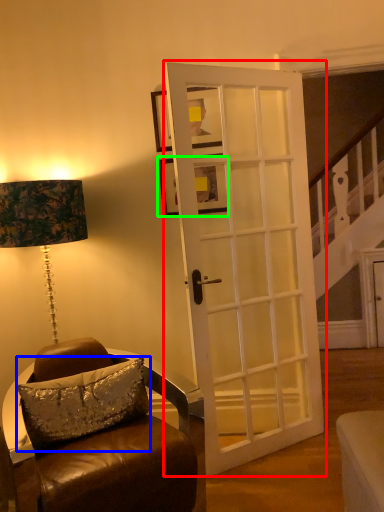
Question: Which is farther away from door (highlighted by a red box)? pillow (highlighted by a blue box) or picture frame (highlighted by a green box)?

Choices:
 (A) pillow
 (B) picture frame

Answer: (A)